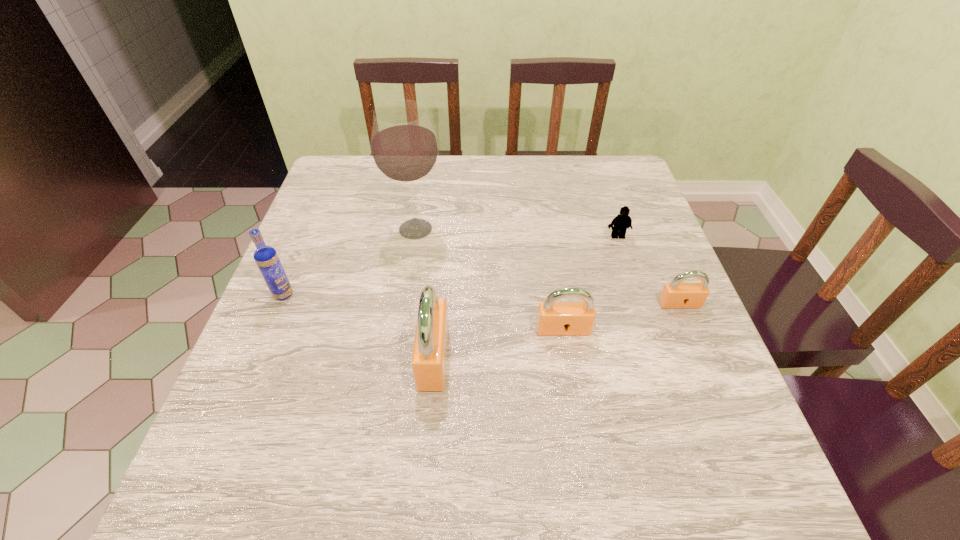
At what (x,y) coordinates should I click in order to perform the action: click on the tallest padlock. Please return your answer as a coordinate pair (x, y). This screenshot has height=540, width=960. Looking at the image, I should click on (429, 358).

Identify the location of the fourth object from left to right. [x=554, y=318].

You are a GUI agent. You are given a task and a screenshot of the screen. Output one action in this format:
    pyautogui.click(x=<x>, y=<y>)
    Task: Click on the second shortest padlock
    This screenshot has height=540, width=960.
    Given the screenshot: What is the action you would take?
    pyautogui.click(x=554, y=318)

Identify the location of the rightmost object. (675, 294).

Image resolution: width=960 pixels, height=540 pixels. What are the coordinates of `the farthest padlock` in the screenshot? It's located at (675, 294).

The image size is (960, 540). I want to click on the leftmost object, so click(x=266, y=257).

The image size is (960, 540). Identify the location of the second object from right to left. (622, 221).

Image resolution: width=960 pixels, height=540 pixels. I want to click on alcohol, so click(x=404, y=148).

At what (x,y) coordinates should I click in order to perform the action: click on free space located 0.330m to unlock the tallest padlock from the front. Please return your answer as a coordinate pair (x, y). This screenshot has height=540, width=960. Looking at the image, I should click on (251, 357).

The image size is (960, 540). Identify the location of vacant region located to unlock the tallest padlock from the front. (369, 357).